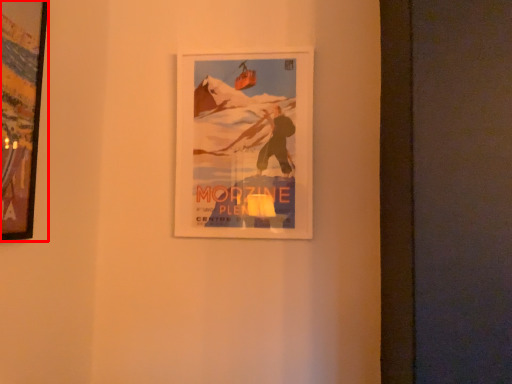
Question: Considering the relative positions of picture frame (annotated by the red box) and picture frame in the image provided, where is picture frame (annotated by the red box) located with respect to the staircase?

Choices:
 (A) left
 (B) right

Answer: (A)